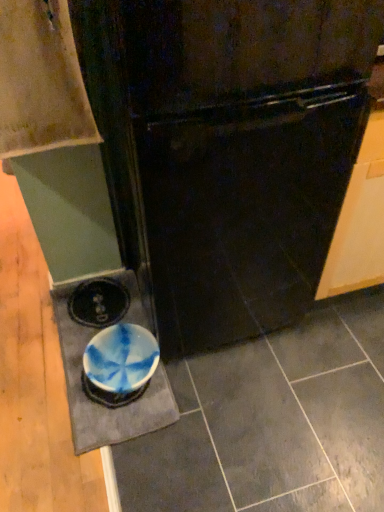
Question: Considering the positions of wooden cabinet at upper left and black glossy refrigerator at center in the image, is wooden cabinet at upper left wider or thinner than black glossy refrigerator at center?

Choices:
 (A) thin
 (B) wide

Answer: (A)

Question: Relative to black glossy refrigerator at center, is wooden cabinet at upper left in front or behind?

Choices:
 (A) front
 (B) behind

Answer: (B)

Question: Is point (33, 17) positioned closer to the camera than point (321, 73)?

Choices:
 (A) farther
 (B) closer

Answer: (A)

Question: Is point (367, 66) positioned closer to the camera than point (6, 9)?

Choices:
 (A) closer
 (B) farther

Answer: (A)

Question: Considering the positions of black glossy refrigerator at center and wooden cabinet at upper left in the image, is black glossy refrigerator at center taller or shorter than wooden cabinet at upper left?

Choices:
 (A) tall
 (B) short

Answer: (A)

Question: In the image, is black glossy refrigerator at center positioned in front of or behind wooden cabinet at upper left?

Choices:
 (A) behind
 (B) front

Answer: (B)

Question: From the image's perspective, relative to wooden cabinet at upper left, is black glossy refrigerator at center above or below?

Choices:
 (A) above
 (B) below

Answer: (B)